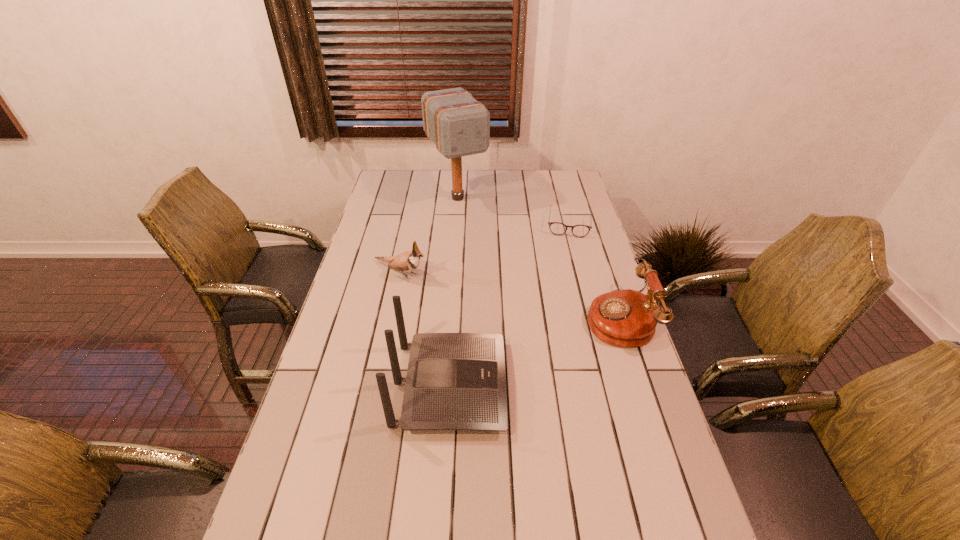
Locate an element on the screen. Image resolution: width=960 pixels, height=540 pixels. telephone situated at the right edge is located at coordinates (626, 318).

The width and height of the screenshot is (960, 540). In order to click on spectacles at the right edge in this screenshot , I will do `click(557, 228)`.

Where is `vacant region at the far edge`? Image resolution: width=960 pixels, height=540 pixels. vacant region at the far edge is located at coordinates (x=422, y=183).

In the image, there is a desktop. Where is `vacant space at the left edge`? vacant space at the left edge is located at coordinates (396, 206).

The image size is (960, 540). Identify the location of free region at the right edge of the desktop. (581, 293).

Identify the location of free location at the far left corner. (396, 197).

Where is `empty space between the router and the telephone`? The width and height of the screenshot is (960, 540). empty space between the router and the telephone is located at coordinates (534, 352).

Image resolution: width=960 pixels, height=540 pixels. Identify the location of free space that is in between the bird and the tallest object. (429, 235).

Locate an element on the screen. This screenshot has height=540, width=960. vacant region between the spectacles and the telephone is located at coordinates (593, 271).

At what (x,y) coordinates should I click in order to perform the action: click on vacant point located between the mallet and the third farthest object. Please return your answer as a coordinate pair (x, y). Image resolution: width=960 pixels, height=540 pixels. Looking at the image, I should click on (429, 235).